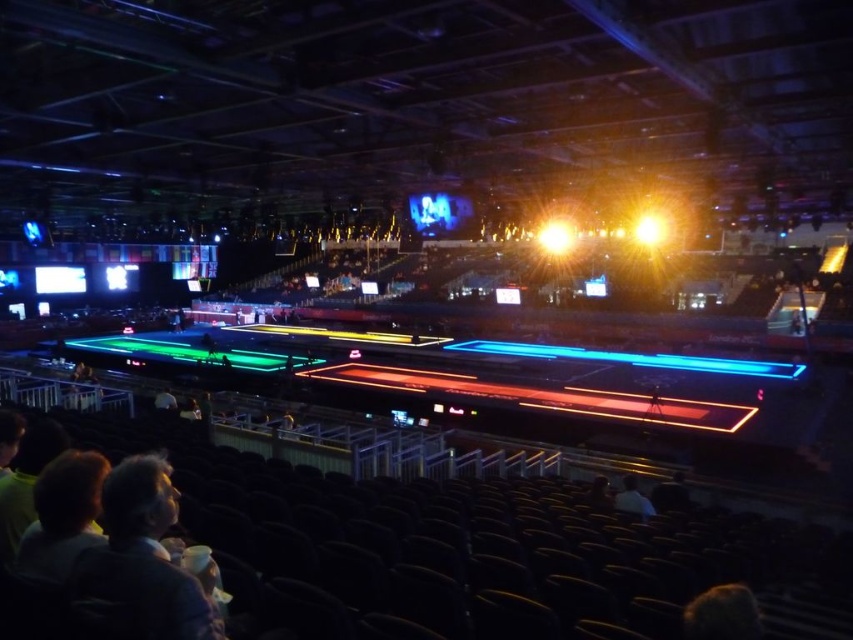
Who is positioned more to the right, bright yellow light at center or dark gray fabric jacket at lower right?

Positioned to the right is bright yellow light at center.

Can you confirm if bright yellow light at center is smaller than dark gray fabric jacket at lower right?

Actually, bright yellow light at center might be larger than dark gray fabric jacket at lower right.

The image size is (853, 640). In order to click on bright yellow light at center in this screenshot , I will do `click(651, 228)`.

Between dark gray fabric jacket at lower right and white fabric person at lower left, which one appears on the right side from the viewer's perspective?

From the viewer's perspective, dark gray fabric jacket at lower right appears more on the right side.

Which is more to the left, dark gray fabric jacket at lower right or white fabric person at lower left?

From the viewer's perspective, white fabric person at lower left appears more on the left side.

Who is more forward, (601, 500) or (157, 394)?

Point (601, 500) is in front.

You are a GUI agent. You are given a task and a screenshot of the screen. Output one action in this format:
    pyautogui.click(x=<x>, y=<y>)
    Task: Click on the dark gray fabric jacket at lower right
    This screenshot has height=640, width=853.
    Given the screenshot: What is the action you would take?
    pyautogui.click(x=601, y=493)

Does white fabric shirt at lower right appear on the left side of dark gray fabric jacket at lower right?

No, white fabric shirt at lower right is not to the left of dark gray fabric jacket at lower right.

Which is behind, point (627, 508) or point (592, 480)?

The point (592, 480) is behind.

The height and width of the screenshot is (640, 853). What are the coordinates of `white fabric shirt at lower right` in the screenshot? It's located at (631, 499).